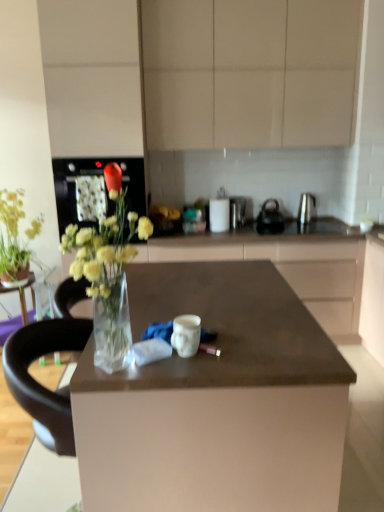
Question: Considering the relative sizes of satin silver kettle at right, positioned as the fourth appliance in left-to-right order, and matte beige cabinets at upper center in the image provided, is satin silver kettle at right, positioned as the fourth appliance in left-to-right order, thinner than matte beige cabinets at upper center?

Choices:
 (A) yes
 (B) no

Answer: (A)

Question: Is satin silver kettle at right, positioned as the fourth appliance in left-to-right order, aimed at matte beige cabinets at upper center?

Choices:
 (A) yes
 (B) no

Answer: (B)

Question: Is satin silver kettle at right, positioned as the fourth appliance in left-to-right order, behind matte beige cabinets at upper center?

Choices:
 (A) yes
 (B) no

Answer: (A)

Question: Does satin silver kettle at right, the 1th appliance in the right-to-left sequence, contain matte beige cabinets at upper center?

Choices:
 (A) yes
 (B) no

Answer: (B)

Question: Does satin silver kettle at right, the 1th appliance in the right-to-left sequence, have a smaller size compared to matte beige cabinets at upper center?

Choices:
 (A) no
 (B) yes

Answer: (B)

Question: From the image's perspective, is green matte plant at upper left, the 2th flower positioned from the front, positioned above or below satin silver kettle at right, the 1th appliance in the right-to-left sequence?

Choices:
 (A) above
 (B) below

Answer: (B)

Question: Considering the positions of green matte plant at upper left, the first flower from the back, and satin silver kettle at right, the 1th appliance in the right-to-left sequence, in the image, is green matte plant at upper left, the first flower from the back, bigger or smaller than satin silver kettle at right, the 1th appliance in the right-to-left sequence,?

Choices:
 (A) small
 (B) big

Answer: (B)

Question: From a real-world perspective, is green matte plant at upper left, the 2th flower positioned from the front, positioned above or below satin silver kettle at right, positioned as the fourth appliance in left-to-right order?

Choices:
 (A) below
 (B) above

Answer: (A)

Question: Is green matte plant at upper left, the 2th flower positioned from the front, taller or shorter than satin silver kettle at right, positioned as the fourth appliance in left-to-right order?

Choices:
 (A) short
 (B) tall

Answer: (B)

Question: Is satin silver toaster at center, the second appliance positioned from the left, to the left or to the right of matte red rose at center, which ranks as the 1th flower in front-to-back order, in the image?

Choices:
 (A) right
 (B) left

Answer: (A)

Question: Considering the positions of satin silver toaster at center, which is the third appliance in right-to-left order, and matte red rose at center, which is the second flower from left to right, in the image, is satin silver toaster at center, which is the third appliance in right-to-left order, bigger or smaller than matte red rose at center, which is the second flower from left to right,?

Choices:
 (A) small
 (B) big

Answer: (B)

Question: From the image's perspective, relative to matte red rose at center, which is the first flower from right to left, is satin silver toaster at center, which is the third appliance in right-to-left order, above or below?

Choices:
 (A) above
 (B) below

Answer: (B)

Question: In terms of width, does satin silver toaster at center, which is the third appliance in right-to-left order, look wider or thinner when compared to matte red rose at center, arranged as the second flower when viewed from the back?

Choices:
 (A) thin
 (B) wide

Answer: (B)

Question: Considering their positions, is satin silver kettle at right, positioned as the fourth appliance in left-to-right order, located in front of or behind polished stainless steel kettle at center, acting as the 2th appliance starting from the right?

Choices:
 (A) behind
 (B) front

Answer: (A)

Question: From the image's perspective, is satin silver kettle at right, positioned as the fourth appliance in left-to-right order, positioned above or below polished stainless steel kettle at center, which ranks as the 3th appliance in left-to-right order?

Choices:
 (A) below
 (B) above

Answer: (B)